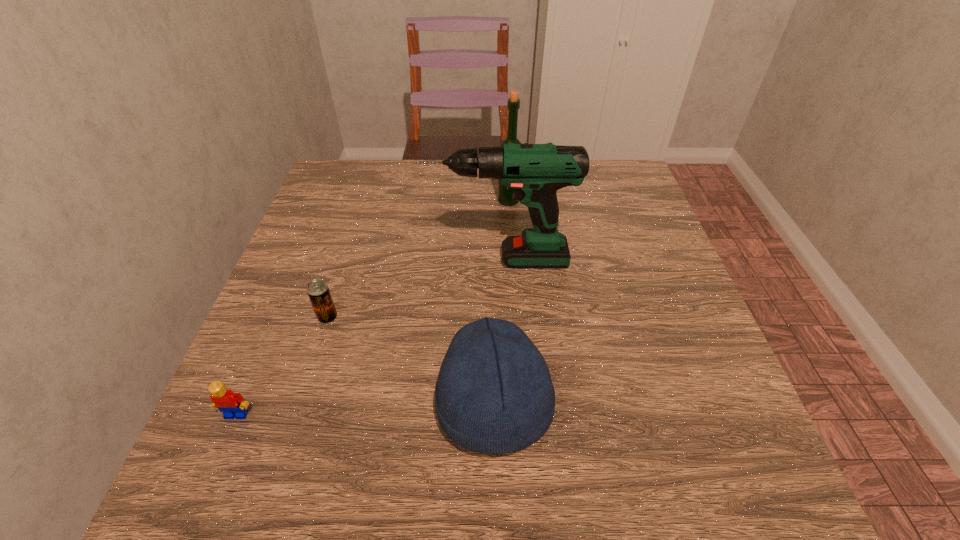
Find the location of `the farthest object`. the farthest object is located at coordinates (504, 195).

The height and width of the screenshot is (540, 960). Find the location of `drill`. drill is located at coordinates (535, 172).

Locate an element on the screen. Image resolution: width=960 pixels, height=540 pixels. the third tallest object is located at coordinates (494, 395).

Identify the location of beer can. (318, 291).

The width and height of the screenshot is (960, 540). Find the location of `the third farthest object`. the third farthest object is located at coordinates (318, 291).

I want to click on Lego, so coord(232,405).

Image resolution: width=960 pixels, height=540 pixels. What are the coordinates of `vacant space located 0.380m on the left of the liquor` in the screenshot? It's located at (350, 200).

At what (x,y) coordinates should I click in order to perform the action: click on free space located 0.170m on the handle side of the fourth nearest object. Please return your answer as a coordinate pair (x, y). The height and width of the screenshot is (540, 960). Looking at the image, I should click on (348, 260).

The height and width of the screenshot is (540, 960). I want to click on vacant region located on the handle side of the fourth nearest object, so click(334, 260).

Locate an element on the screen. free space located 0.230m on the handle side of the fourth nearest object is located at coordinates (321, 260).